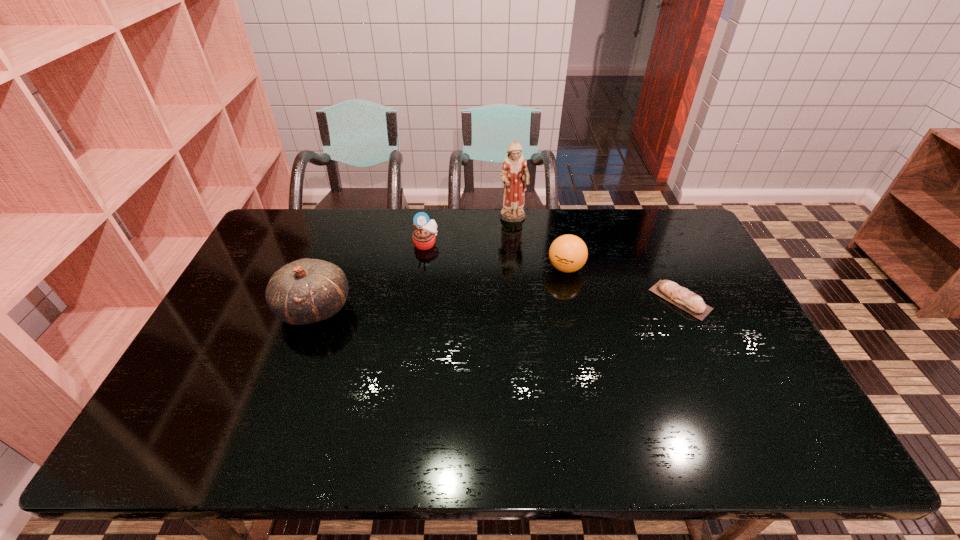
I want to click on muffin at the far edge, so tap(424, 235).

Locate an element on the screen. The height and width of the screenshot is (540, 960). figurine present at the far edge is located at coordinates click(x=515, y=175).

This screenshot has width=960, height=540. I want to click on object present at the left edge, so click(x=305, y=291).

Locate an element on the screen. This screenshot has width=960, height=540. object positioned at the right edge is located at coordinates (688, 301).

Find the location of a particular element. The image size is (960, 540). free space at the far edge of the desktop is located at coordinates (600, 239).

Find the location of a particular element. The width and height of the screenshot is (960, 540). vacant space at the near edge of the desktop is located at coordinates (516, 406).

Image resolution: width=960 pixels, height=540 pixels. In the image, there is a desktop. In order to click on vacant space at the left edge in this screenshot , I will do `click(262, 310)`.

I want to click on vacant region at the right edge of the desktop, so click(x=725, y=314).

The width and height of the screenshot is (960, 540). Find the location of `free region at the far right corner of the desktop`. free region at the far right corner of the desktop is located at coordinates (671, 245).

I want to click on vacant space that is in between the pita bread and the fourth shortest object, so click(x=497, y=304).